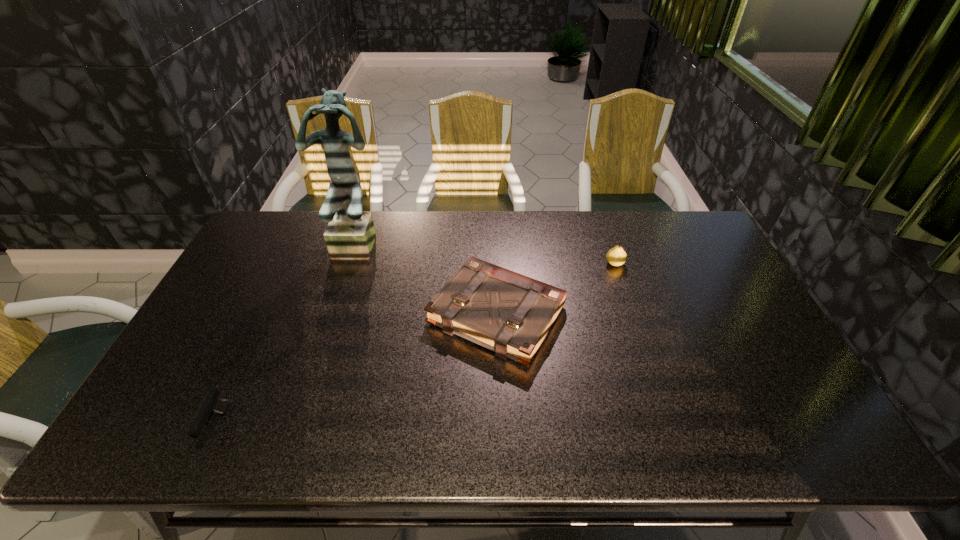
The width and height of the screenshot is (960, 540). I want to click on object at the near edge, so click(x=212, y=404).

Locate an element on the screen. This screenshot has height=540, width=960. free space at the far edge is located at coordinates pos(497,226).

In the image, there is a desktop. Identify the location of vacant space at the near edge. The width and height of the screenshot is (960, 540). (595, 435).

Image resolution: width=960 pixels, height=540 pixels. I want to click on free region at the left edge of the desktop, so click(x=263, y=257).

The width and height of the screenshot is (960, 540). I want to click on vacant region at the right edge of the desktop, so click(x=711, y=261).

Where is `vacant area between the tallest object and the nearest object`? The width and height of the screenshot is (960, 540). vacant area between the tallest object and the nearest object is located at coordinates (289, 334).

Locate an element on the screen. Image resolution: width=960 pixels, height=540 pixels. free space between the sculpture and the second object from right to left is located at coordinates (429, 279).

Locate an element on the screen. This screenshot has width=960, height=540. empty space between the sculpture and the hardback book is located at coordinates pos(429,279).

Where is `vacant space that is in between the second object from right to left and the leftmost object`? This screenshot has height=540, width=960. vacant space that is in between the second object from right to left and the leftmost object is located at coordinates (357, 370).

Identify the location of vacant space in between the pear and the nearest object. (416, 345).